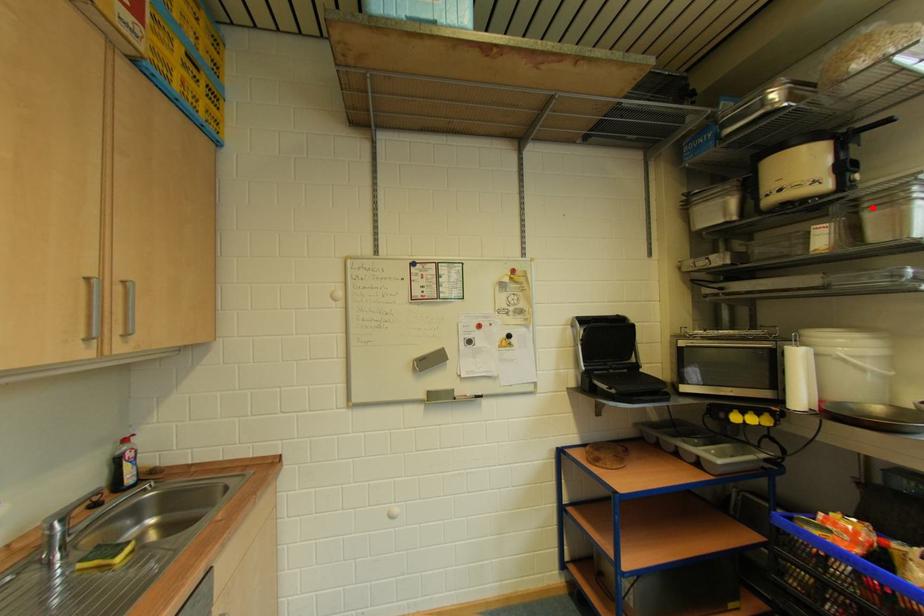
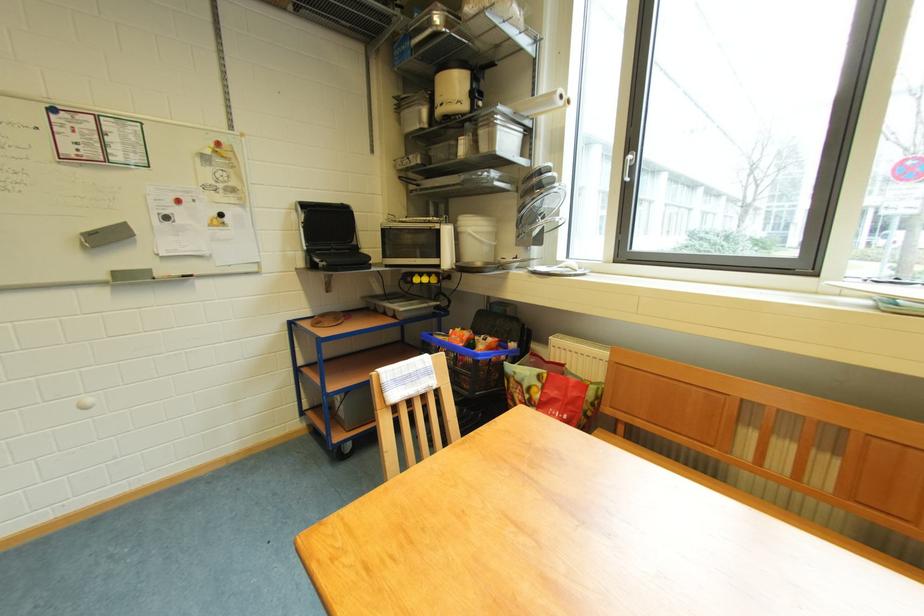
The point at the highlighted location is marked in the first image. Where is the corresponding point in the second image?

(488, 127)